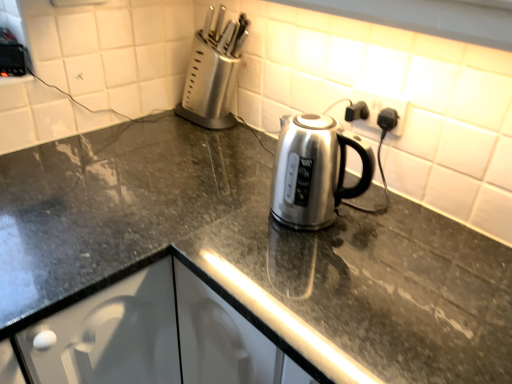
Locate an element on the screen. vacant area to the left of satin silver knife block at upper left is located at coordinates (145, 128).